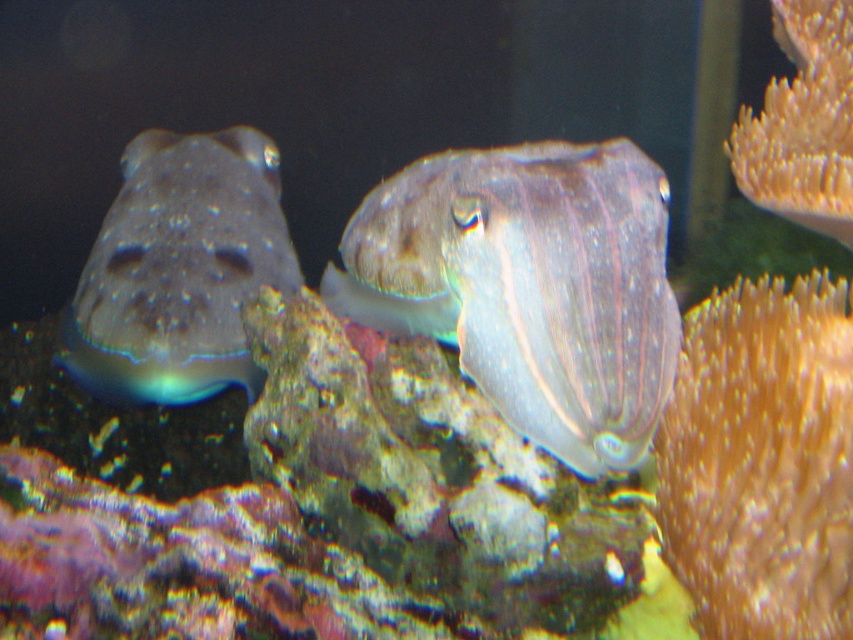
Question: Is orange soft coral at right wider than yellow frilly coral at upper right?

Choices:
 (A) no
 (B) yes

Answer: (B)

Question: Which of these objects is positioned farthest from the orange soft coral at right?

Choices:
 (A) translucent rubber fish at left
 (B) translucent rubber squid at center

Answer: (A)

Question: Which point appears farthest from the camera in this image?

Choices:
 (A) (804, 100)
 (B) (590, 195)
 (C) (769, 474)

Answer: (A)

Question: Which is nearer to the yellow frilly coral at upper right?

Choices:
 (A) translucent rubber fish at left
 (B) orange soft coral at right

Answer: (B)

Question: Considering the relative positions of translucent rubber squid at center and yellow frilly coral at upper right in the image provided, where is translucent rubber squid at center located with respect to yellow frilly coral at upper right?

Choices:
 (A) below
 (B) above

Answer: (A)

Question: Can you confirm if translucent rubber squid at center is positioned to the left of yellow frilly coral at upper right?

Choices:
 (A) no
 (B) yes

Answer: (B)